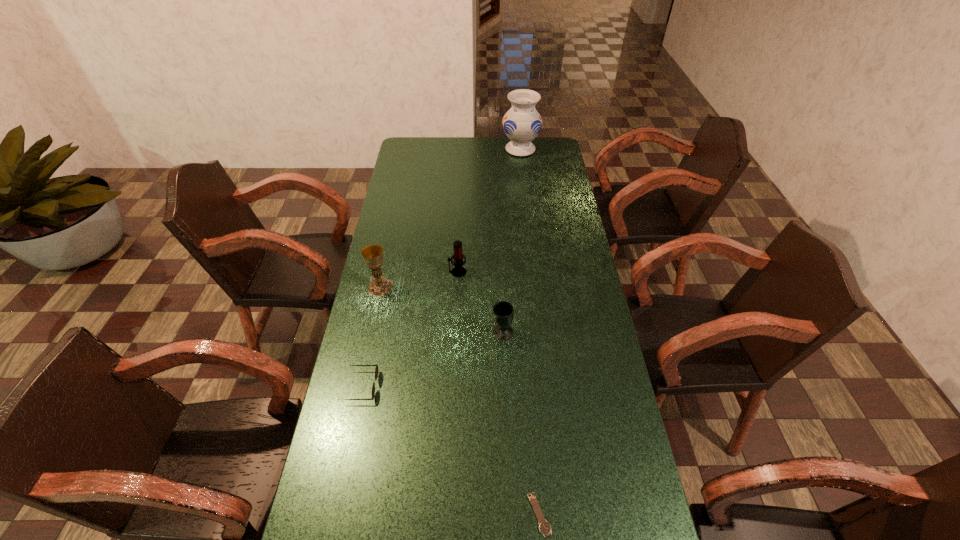
In order to click on sunglasses located in the left edge section of the desktop in this screenshot , I will do `click(376, 370)`.

Find the location of a particular element. object located at the right edge is located at coordinates (522, 123).

Locate an element on the screen. object that is at the far right corner is located at coordinates (522, 123).

What are the coordinates of `blank space at the far edge of the desktop` in the screenshot? It's located at (474, 137).

Locate an element on the screen. This screenshot has width=960, height=540. vacant space at the left edge of the desktop is located at coordinates (401, 363).

This screenshot has width=960, height=540. Find the location of `vacant region at the right edge of the desktop`. vacant region at the right edge of the desktop is located at coordinates (555, 306).

In the image, there is a desktop. Identify the location of free region at the far left corner. The height and width of the screenshot is (540, 960). (407, 138).

Find the location of a particular element. Image resolution: width=960 pixels, height=540 pixels. free space at the far right corner is located at coordinates (559, 148).

Identify the location of vacant area that lies between the farther chalice and the sunglasses. (372, 336).

Find the location of `free point between the tallest object and the third shortest object`. free point between the tallest object and the third shortest object is located at coordinates (512, 241).